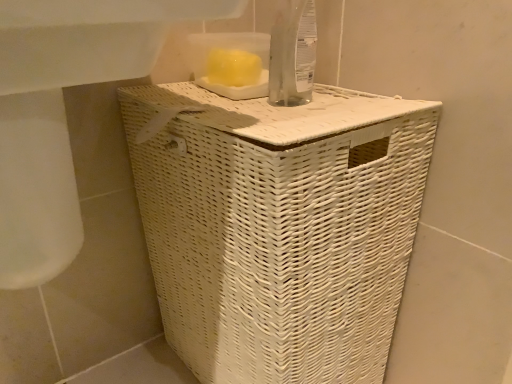
Find the location of a particular element. The height and width of the screenshot is (384, 512). white wicker basket at lower center is located at coordinates (64, 111).

What do you see at coordinates (64, 111) in the screenshot? The height and width of the screenshot is (384, 512). I see `white wicker basket at lower center` at bounding box center [64, 111].

Identify the location of white wicker laundry basket at center. (279, 227).

Describe the element at coordinates (279, 227) in the screenshot. The height and width of the screenshot is (384, 512). I see `white wicker laundry basket at center` at that location.

Identify the location of white wicker basket at lower center. (64, 111).

In the image, is white wicker laundry basket at center on the left side or the right side of white wicker basket at lower center?

white wicker laundry basket at center is to the right of white wicker basket at lower center.

Is white wicker laundry basket at center behind white wicker basket at lower center?

That is True.

Considering the positions of point (259, 127) and point (57, 33), is point (259, 127) closer or farther from the camera than point (57, 33)?

Point (259, 127) is farther from the camera than point (57, 33).

From the image's perspective, is white wicker laundry basket at center beneath white wicker basket at lower center?

Correct, white wicker laundry basket at center appears lower than white wicker basket at lower center in the image.

From a real-world perspective, between white wicker laundry basket at center and white wicker basket at lower center, who is vertically higher?

white wicker basket at lower center.

Is white wicker laundry basket at center wider or thinner than white wicker basket at lower center?

In the image, white wicker laundry basket at center appears to be more narrow than white wicker basket at lower center.

Considering the relative sizes of white wicker laundry basket at center and white wicker basket at lower center in the image provided, is white wicker laundry basket at center shorter than white wicker basket at lower center?

Incorrect, the height of white wicker laundry basket at center does not fall short of that of white wicker basket at lower center.

Considering the sizes of objects white wicker laundry basket at center and white wicker basket at lower center in the image provided, who is smaller, white wicker laundry basket at center or white wicker basket at lower center?

Smaller between the two is white wicker basket at lower center.

Is white wicker basket at lower center a part of white wicker laundry basket at center?

That's incorrect, white wicker basket at lower center is not inside white wicker laundry basket at center.

Is the surface of white wicker laundry basket at center in direct contact with white wicker basket at lower center?

No, white wicker laundry basket at center is not beside white wicker basket at lower center.

Could you tell me if white wicker laundry basket at center is facing white wicker basket at lower center?

No, white wicker laundry basket at center is not oriented towards white wicker basket at lower center.

This screenshot has width=512, height=384. In order to click on waste container beneath the white wicker basket at lower center (from a real-world perspective) in this screenshot , I will do `click(279, 227)`.

Does white wicker basket at lower center appear on the left side of white wicker laundry basket at center?

Yes.

Between white wicker basket at lower center and white wicker laundry basket at center, which one is positioned behind?

white wicker laundry basket at center is further from the camera.

Does point (45, 39) appear closer or farther from the camera than point (254, 128)?

Clearly, point (45, 39) is closer to the camera than point (254, 128).

From the image's perspective, is white wicker basket at lower center over white wicker laundry basket at center?

Indeed, from the image's perspective, white wicker basket at lower center is shown above white wicker laundry basket at center.

From a real-world perspective, relative to white wicker laundry basket at center, is white wicker basket at lower center vertically above or below?

Clearly, from a real-world perspective, white wicker basket at lower center is above white wicker laundry basket at center.

Which of these two, white wicker basket at lower center or white wicker laundry basket at center, is wider?

white wicker basket at lower center.

Considering the sizes of objects white wicker basket at lower center and white wicker laundry basket at center in the image provided, who is taller, white wicker basket at lower center or white wicker laundry basket at center?

With more height is white wicker laundry basket at center.

Which of these two, white wicker basket at lower center or white wicker laundry basket at center, is bigger?

With larger size is white wicker laundry basket at center.

Is white wicker basket at lower center situated inside white wicker laundry basket at center or outside?

white wicker basket at lower center is not inside white wicker laundry basket at center, it's outside.

Are white wicker basket at lower center and white wicker laundry basket at center far apart?

No.

Looking at this image, is white wicker basket at lower center aimed at white wicker laundry basket at center?

No.

Find the location of `sink above the white wicker laundry basket at center (from a real-world perspective)`. sink above the white wicker laundry basket at center (from a real-world perspective) is located at coordinates (64, 111).

Locate an element on the screen. This screenshot has height=384, width=512. waste container on the right of the white wicker basket at lower center is located at coordinates (279, 227).

Find the location of a particular element. Image resolution: width=512 pixels, height=384 pixels. sink that is above the white wicker laundry basket at center (from the image's perspective) is located at coordinates (64, 111).